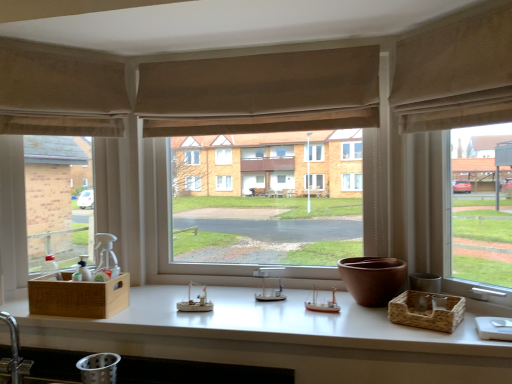
The width and height of the screenshot is (512, 384). What are the coordinates of `free location above brown matte vase at center (from a real-world perspective)` in the screenshot? It's located at (374, 264).